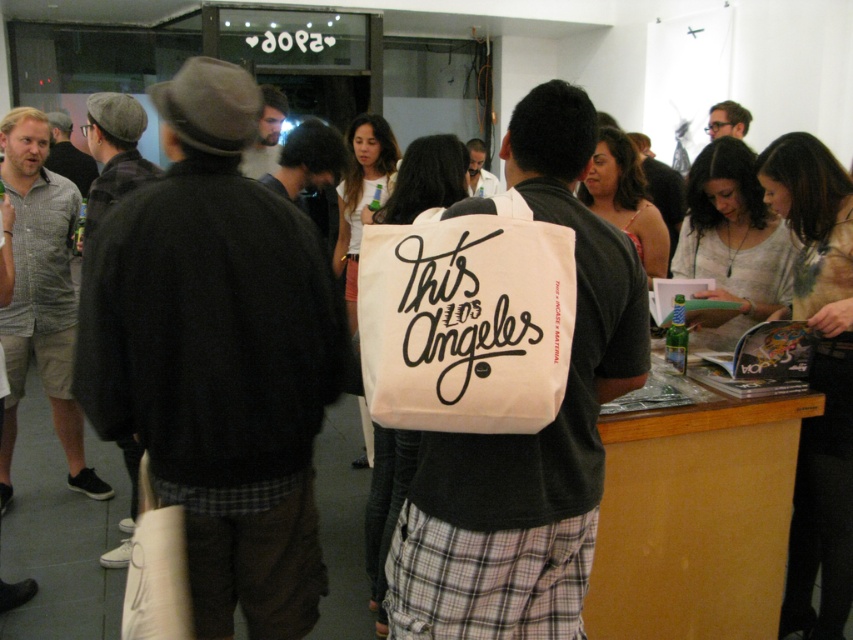
Question: Considering the relative positions of dark brown woolen jacket at left and white canvas tote bag at center in the image provided, where is dark brown woolen jacket at left located with respect to white canvas tote bag at center?

Choices:
 (A) above
 (B) below

Answer: (A)

Question: In this image, where is matte black hat at upper left located relative to matte black glasses at upper center?

Choices:
 (A) left
 (B) right

Answer: (A)

Question: Can you confirm if checkered cotton shirt at left is positioned below matte black glasses at upper center?

Choices:
 (A) yes
 (B) no

Answer: (A)

Question: Which of the following is the closest to the observer?

Choices:
 (A) dark brown leather jacket at left
 (B) white canvas tote bag at center
 (C) checkered cotton shirt at left
 (D) light beige shirt at center

Answer: (B)

Question: Which of the following is the closest to the observer?

Choices:
 (A) matte black glasses at upper center
 (B) white canvas tote bag at center
 (C) matte black hat at upper left

Answer: (B)

Question: Which point is closer to the camera taking this photo?

Choices:
 (A) (405, 358)
 (B) (259, 179)
 (C) (595, 440)
 (D) (714, 113)

Answer: (A)